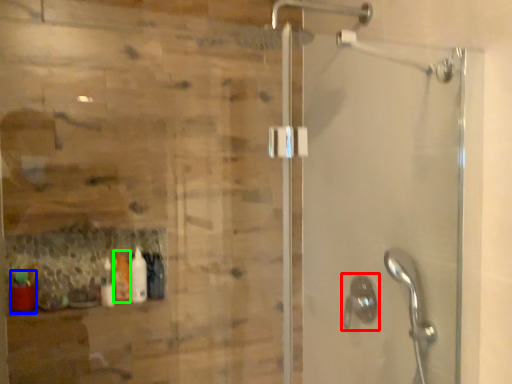
Question: Based on their relative distances, which object is nearer to shower (highlighted by a red box)? Choose from bottle (highlighted by a blue box) and bottle (highlighted by a green box).

Choices:
 (A) bottle
 (B) bottle

Answer: (B)